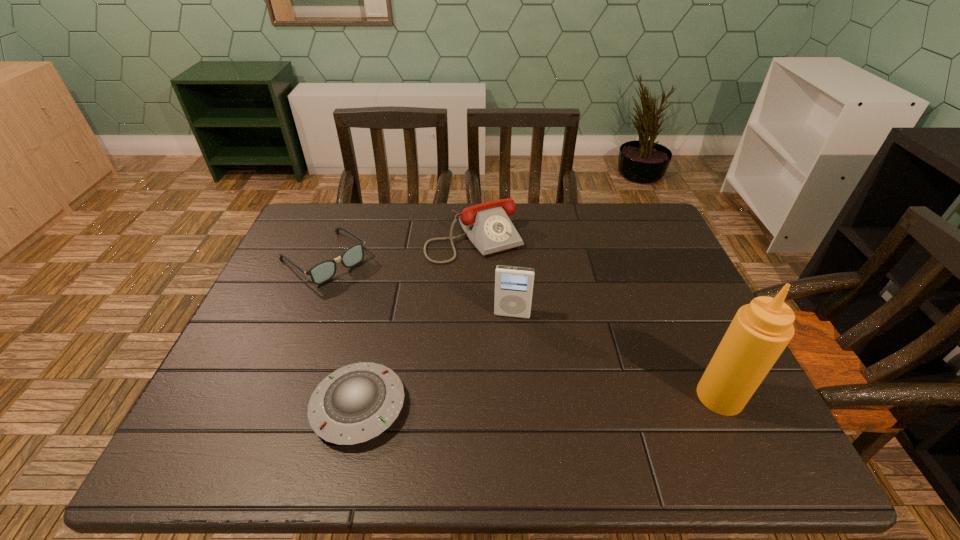
You are a GUI agent. You are given a task and a screenshot of the screen. Output one action in this format:
    pyautogui.click(x=<x>, y=<y>)
    Task: Click on the saucer positioned at the near edge
    The width and height of the screenshot is (960, 540).
    Given the screenshot: What is the action you would take?
    [356, 403]

Where is `condiment situated at the near edge`? Image resolution: width=960 pixels, height=540 pixels. condiment situated at the near edge is located at coordinates (760, 331).

The height and width of the screenshot is (540, 960). Identify the location of object positioned at the left edge. (323, 271).

Find the location of `object that is at the right edge`. object that is at the right edge is located at coordinates (760, 331).

Locate an element on the screen. object that is at the far left corner is located at coordinates (323, 271).

You are a GUI agent. You are given a task and a screenshot of the screen. Output one action in this format:
    pyautogui.click(x=<x>, y=<y>)
    Task: Click on the object that is positioned at the near right corner
    The image size is (960, 540).
    Given the screenshot: What is the action you would take?
    pyautogui.click(x=760, y=331)

Where is `free location at the far edge`? The width and height of the screenshot is (960, 540). free location at the far edge is located at coordinates (582, 219).

Locate an element on the screen. This screenshot has width=960, height=540. vacant space at the near edge is located at coordinates (441, 393).

Locate an element on the screen. blank area at the left edge is located at coordinates (301, 266).

The image size is (960, 540). Find the location of `free space at the right edge`. free space at the right edge is located at coordinates (651, 306).